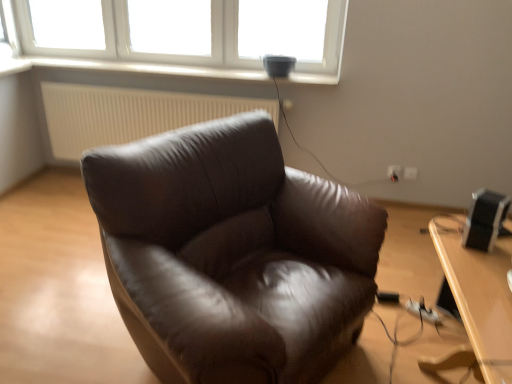
You are a GUI agent. You are given a task and a screenshot of the screen. Output one action in this format:
    pyautogui.click(x=<x>, y=<y>)
    Task: Click on the vacant region above white textured radiator at upper center (from a real-world perspective)
    The width and height of the screenshot is (512, 384).
    Given the screenshot: What is the action you would take?
    pyautogui.click(x=122, y=82)